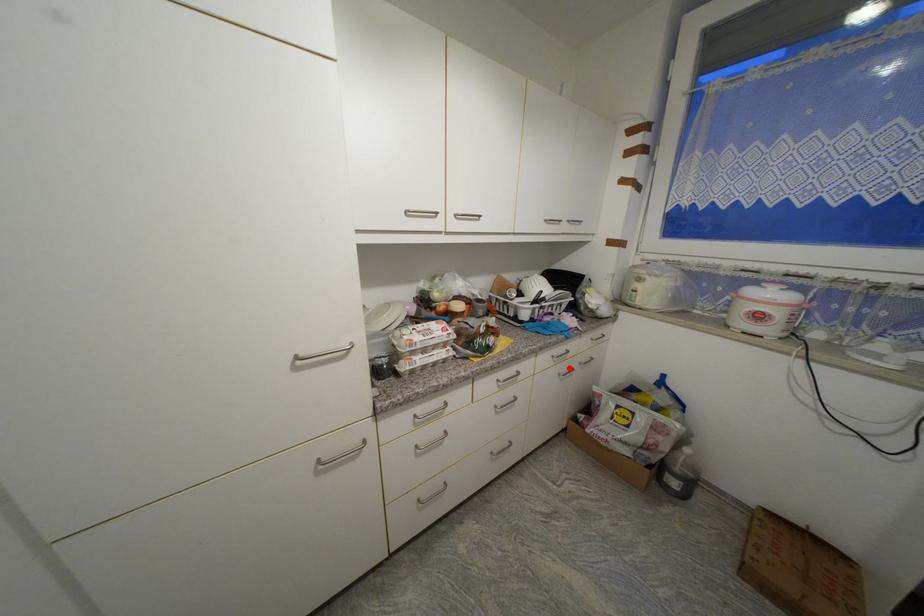
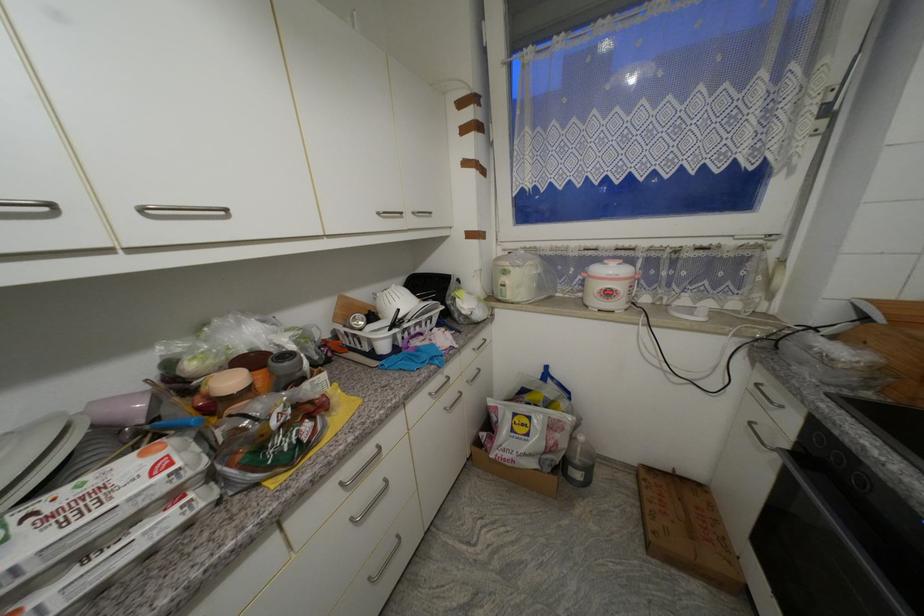
Where in the second image is the point corresponding to the highlighted location from the first image?

(455, 398)